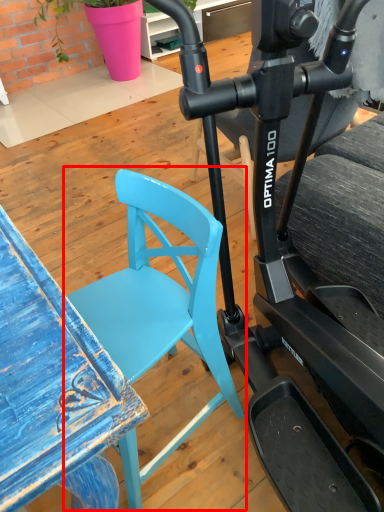
Question: From the image's perspective, considering the relative positions of chair (annotated by the red box) and stationary bicycle in the image provided, where is chair (annotated by the red box) located with respect to the staircase?

Choices:
 (A) above
 (B) below

Answer: (B)